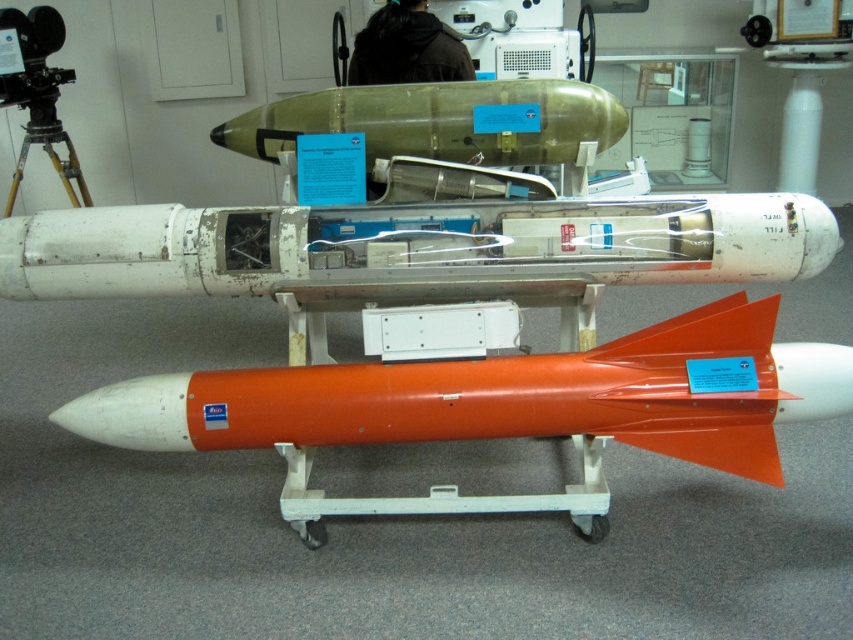
In the scene shown: Is orange matte rocket at center taller than gold/yellow metal tripod at left?

In fact, orange matte rocket at center may be shorter than gold/yellow metal tripod at left.

Does point (196, 388) come closer to viewer compared to point (47, 97)?

That is True.

Where is `orange matte rocket at center`? orange matte rocket at center is located at coordinates (488, 397).

Locate an element on the screen. The image size is (853, 640). orange matte rocket at center is located at coordinates (488, 397).

Who is shorter, white matte missile at center or gold/yellow metal tripod at left?

white matte missile at center

Is white matte missile at center further to the viewer compared to gold/yellow metal tripod at left?

No, it is in front of gold/yellow metal tripod at left.

The image size is (853, 640). Find the location of `white matte missile at center`. white matte missile at center is located at coordinates (415, 248).

Who is shorter, white matte missile at center or orange matte rocket at center?

Standing shorter between the two is white matte missile at center.

Which is in front, point (787, 228) or point (364, 384)?

Positioned in front is point (787, 228).

Where is `white matte missile at center`? Image resolution: width=853 pixels, height=640 pixels. white matte missile at center is located at coordinates (415, 248).